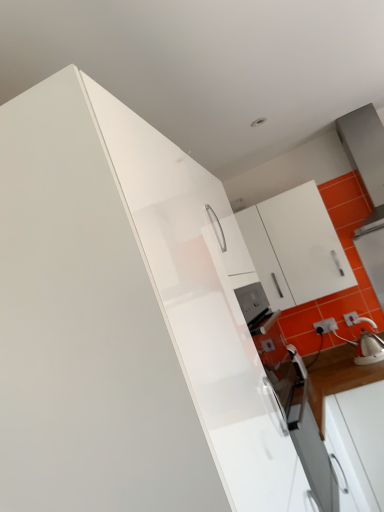
Question: Looking at their shapes, would you say white glossy kettle at right is wider or thinner than white glossy cabinet at upper left, acting as the 1th cabinetry starting from the front?

Choices:
 (A) thin
 (B) wide

Answer: (A)

Question: Is white glossy kettle at right in front of or behind white glossy cabinet at upper left, marked as the first cabinetry in a left-to-right arrangement, in the image?

Choices:
 (A) front
 (B) behind

Answer: (B)

Question: Which object is positioned farthest from the white glossy cabinet at upper right, arranged as the second cabinetry when viewed from the front?

Choices:
 (A) white glossy cabinet at upper left, marked as the first cabinetry in a left-to-right arrangement
 (B) white plastic electric outlet at lower right
 (C) white glossy kettle at right

Answer: (A)

Question: Which object is positioned farthest from the white glossy kettle at right?

Choices:
 (A) white plastic electric outlet at lower right
 (B) white glossy cabinet at upper left, marked as the first cabinetry in a left-to-right arrangement
 (C) white glossy cabinet at upper right, the second cabinetry positioned from the left

Answer: (B)